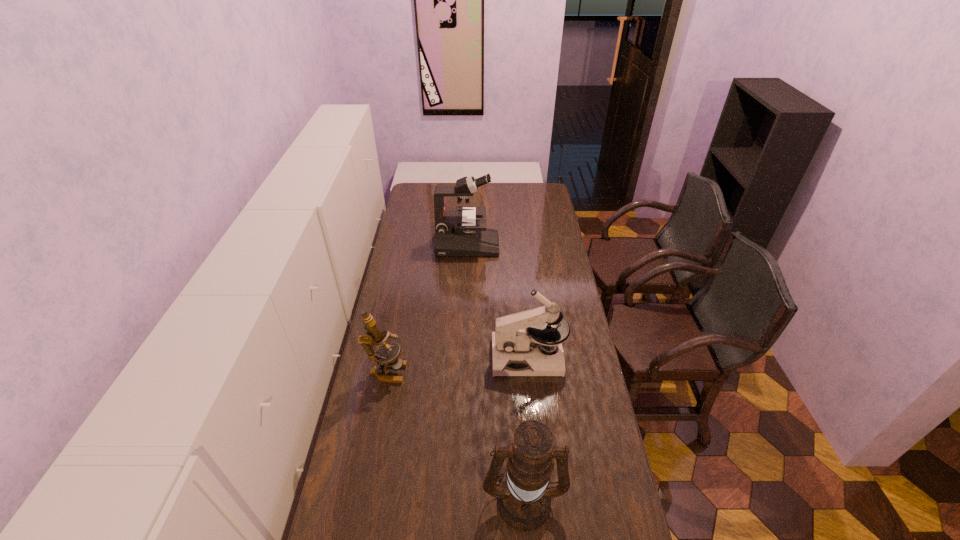
In the image, there is a desktop. In order to click on vacant space at the right edge in this screenshot , I will do click(x=564, y=294).

What are the coordinates of `free space at the far right corner of the desktop` in the screenshot? It's located at (544, 202).

The image size is (960, 540). I want to click on free space between the leftmost object and the oil lamp, so click(455, 435).

The width and height of the screenshot is (960, 540). Identify the location of free space between the nearest object and the leftmost object. (455, 435).

Where is `empty location between the nearest object and the leftmost microscope`? Image resolution: width=960 pixels, height=540 pixels. empty location between the nearest object and the leftmost microscope is located at coordinates (455, 435).

Find the location of a particular element. The width and height of the screenshot is (960, 540). vacant region between the farthest object and the leftmost microscope is located at coordinates (427, 308).

Locate an element on the screen. vacant space that is in between the leftmost microscope and the nearest object is located at coordinates (455, 435).

The image size is (960, 540). In order to click on vacant area between the nearest object and the leftmost object in this screenshot , I will do `click(455, 435)`.

This screenshot has width=960, height=540. I want to click on the closest object to the nearest object, so click(518, 338).

Select which object is the second closest to the nearest object. Please provide its 2D coordinates. Your answer should be formatted as a tuple, i.e. [(x, y)], where the tuple contains the x and y coordinates of a point satisfying the conditions above.

[(374, 336)]